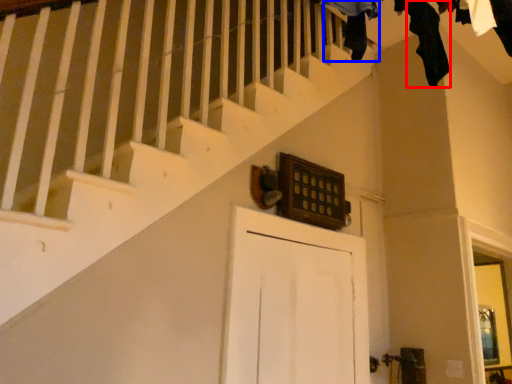
Question: Which object is closer to the camera taking this photo, clothing (highlighted by a red box) or clothing (highlighted by a blue box)?

Choices:
 (A) clothing
 (B) clothing

Answer: (B)